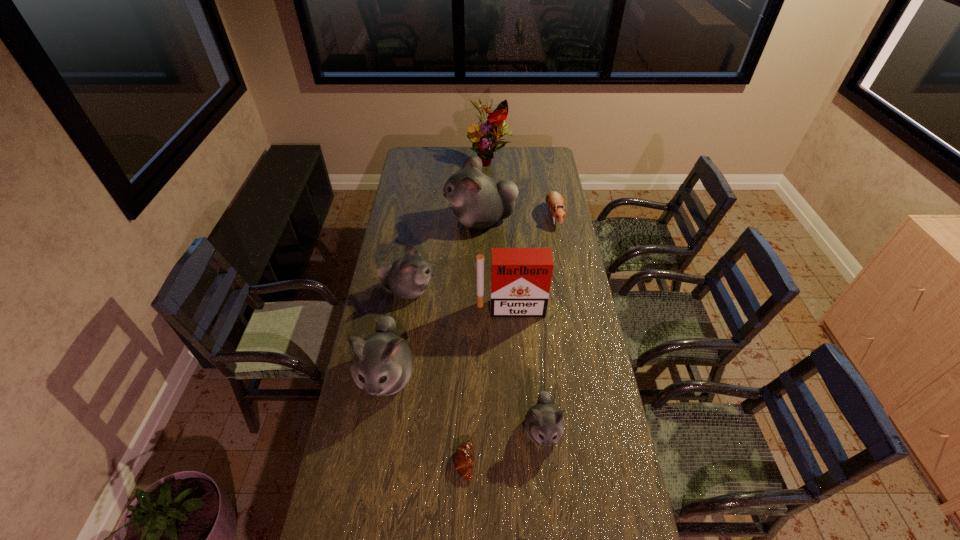
The width and height of the screenshot is (960, 540). Find the location of `the shortest hamster`. the shortest hamster is located at coordinates (554, 200).

You are a GUI agent. You are given a task and a screenshot of the screen. Output one action in this format:
    pyautogui.click(x=<x>, y=<y>)
    Task: Click on the shortest object
    This screenshot has height=540, width=960.
    Given the screenshot: What is the action you would take?
    pyautogui.click(x=463, y=458)

At what (x,y) coordinates should I click in order to perform the action: click on brown crescent roll. Please return your answer as a coordinate pair (x, y). Image resolution: width=960 pixels, height=540 pixels. Looking at the image, I should click on (463, 458).

Locate an element on the screen. vacant space situated 0.180m on the front-facing side of the farthest object is located at coordinates (491, 192).

Where is `vacant space located 0.250m on the face of the biggest white hamster`? The width and height of the screenshot is (960, 540). vacant space located 0.250m on the face of the biggest white hamster is located at coordinates click(396, 220).

At what (x,y) coordinates should I click in order to perform the action: click on free region located on the face of the biggest white hamster. Please return your answer as a coordinate pair (x, y). Image resolution: width=960 pixels, height=540 pixels. Looking at the image, I should click on (404, 220).

I want to click on free space located 0.210m on the face of the biggest white hamster, so click(x=404, y=220).

Where is `vacant area situated on the front-facing side of the cigarette case`? The width and height of the screenshot is (960, 540). vacant area situated on the front-facing side of the cigarette case is located at coordinates (515, 373).

Where is `vacant point located 0.340m on the face of the second biggest white hamster`? Image resolution: width=960 pixels, height=540 pixels. vacant point located 0.340m on the face of the second biggest white hamster is located at coordinates (362, 525).

Where is `vacant region located 0.210m on the face of the third nearest white hamster`? The height and width of the screenshot is (540, 960). vacant region located 0.210m on the face of the third nearest white hamster is located at coordinates (485, 290).